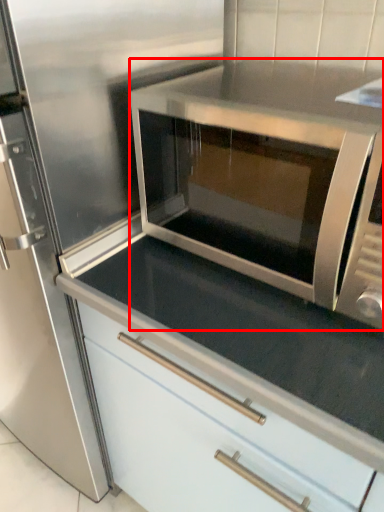
Question: From the image's perspective, what is the correct spatial positioning of microwave oven (annotated by the red box) in reference to cabinetry?

Choices:
 (A) above
 (B) below

Answer: (A)